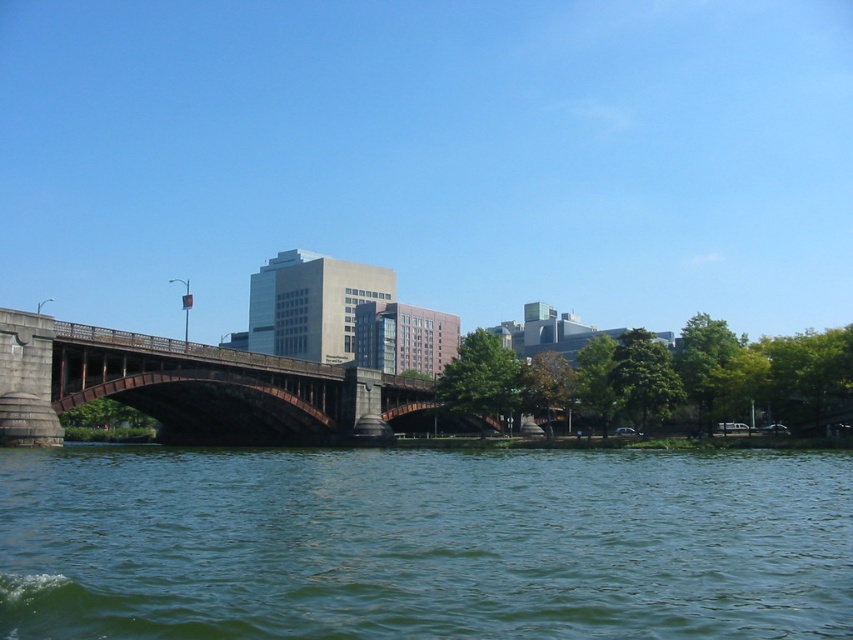
Does green water at lower center have a greater width compared to brown stone bridge at center?

Correct, the width of green water at lower center exceeds that of brown stone bridge at center.

Does green water at lower center lie behind brown stone bridge at center?

No, it is in front of brown stone bridge at center.

Between point (144, 525) and point (262, 403), which one is positioned in front?

Point (144, 525) is more forward.

Where is `green water at lower center`? This screenshot has width=853, height=640. green water at lower center is located at coordinates (422, 544).